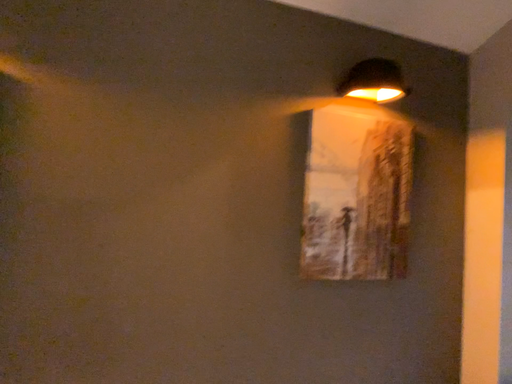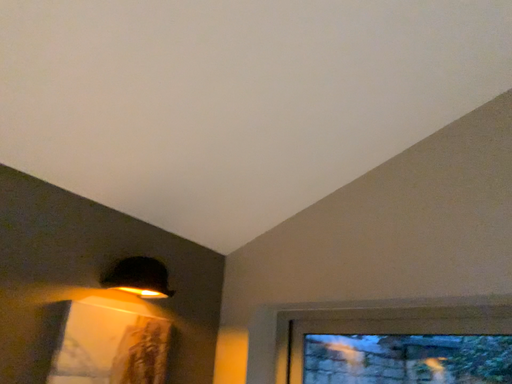
Question: Which way did the camera rotate in the video?

Choices:
 (A) rotated left
 (B) rotated right

Answer: (B)